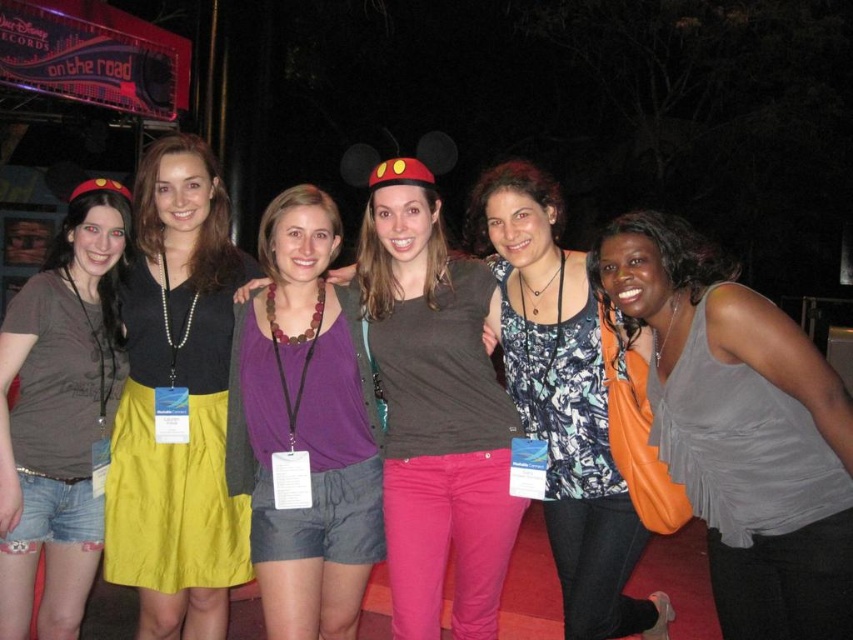
Does gray satin tank top at lower right have a larger size compared to yellow fabric skirt at center?

Indeed, gray satin tank top at lower right has a larger size compared to yellow fabric skirt at center.

Is gray satin tank top at lower right taller than yellow fabric skirt at center?

Incorrect, gray satin tank top at lower right's height is not larger of yellow fabric skirt at center's.

Which is behind, point (780, 577) or point (161, 572)?

The point (161, 572) is behind.

Find the location of a particular element. This screenshot has height=640, width=853. gray satin tank top at lower right is located at coordinates (741, 429).

Who is higher up, gray satin tank top at lower right or matte pink pants at center?

gray satin tank top at lower right

Who is more forward, (672, 364) or (438, 628)?

Point (672, 364)

Is point (688, 285) positioned before point (469, 627)?

Yes, it is in front of point (469, 627).

This screenshot has height=640, width=853. Identify the location of gray satin tank top at lower right. (741, 429).

Is yellow fabric skirt at center behind matte black shirt at center?

Yes, yellow fabric skirt at center is further from the viewer.

In the scene shown: Which is above, yellow fabric skirt at center or matte black shirt at center?

Positioned higher is yellow fabric skirt at center.

Who is more distant from viewer, (171, 250) or (86, 474)?

Point (171, 250)

At what (x,y) coordinates should I click in order to perform the action: click on yellow fabric skirt at center. Please return your answer as a coordinate pair (x, y). Image resolution: width=853 pixels, height=640 pixels. Looking at the image, I should click on (178, 403).